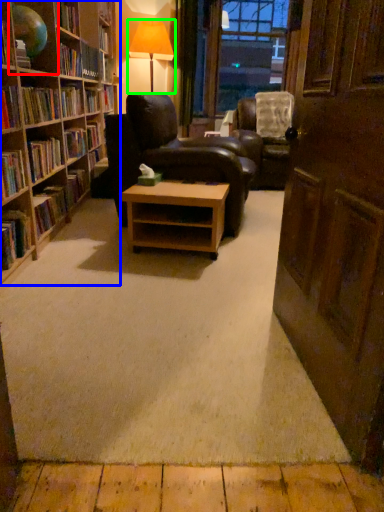
Question: Based on their relative distances, which object is nearer to shelf (highlighted by a red box)? Choose from bookcase (highlighted by a blue box) and table lamp (highlighted by a green box).

Choices:
 (A) bookcase
 (B) table lamp

Answer: (A)